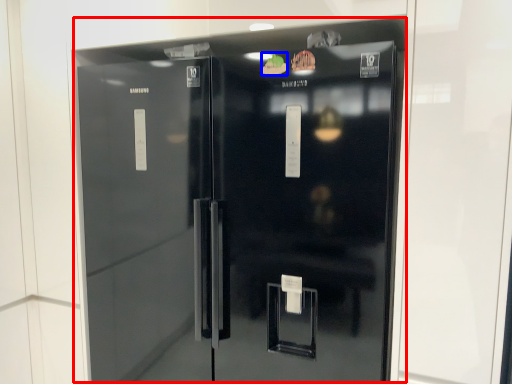
Question: Which object is closer to the camera taking this photo, refrigerator (highlighted by a red box) or food (highlighted by a blue box)?

Choices:
 (A) refrigerator
 (B) food

Answer: (A)